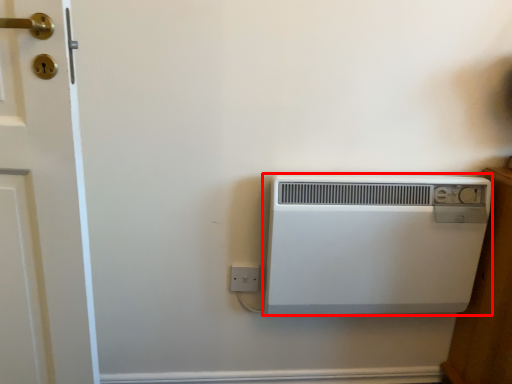
Question: From the image's perspective, what is the correct spatial relationship of home appliance (annotated by the red box) in relation to electric outlet?

Choices:
 (A) above
 (B) below

Answer: (A)